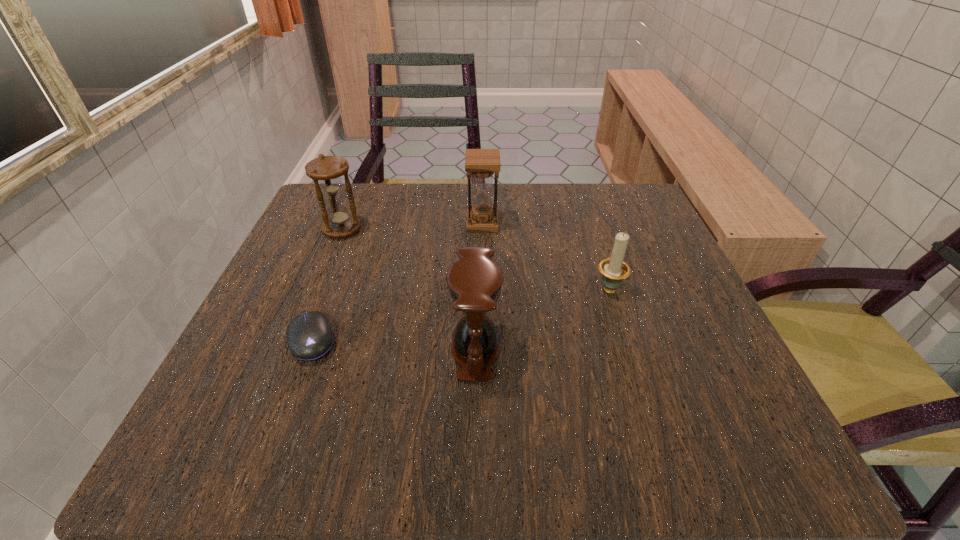
Find the location of a particular element. Image resolution: width=960 pixels, height=540 pixels. the leftmost hourglass is located at coordinates (326, 171).

This screenshot has height=540, width=960. Identify the location of the nearest hourglass. (475, 281).

Identify the location of candle_holder. (614, 270).

Identify the location of the second shortest object. The height and width of the screenshot is (540, 960). (614, 270).

In order to click on the shortest object in this screenshot , I will do `click(309, 336)`.

The width and height of the screenshot is (960, 540). I want to click on vacant space positioned 0.240m on the front of the leftmost hourglass, so click(302, 328).

The image size is (960, 540). I want to click on free region located on the back of the nearest hourglass, so coord(476,284).

At what (x,y) coordinates should I click in order to perform the action: click on blank space located 0.290m on the handle side of the candle_holder. Please return your answer as a coordinate pair (x, y). Looking at the image, I should click on tap(579, 195).

Image resolution: width=960 pixels, height=540 pixels. I want to click on vacant point located 0.080m on the handle side of the candle_holder, so click(596, 249).

The height and width of the screenshot is (540, 960). Find the location of `blank space located on the handle side of the candle_holder`. blank space located on the handle side of the candle_holder is located at coordinates (579, 198).